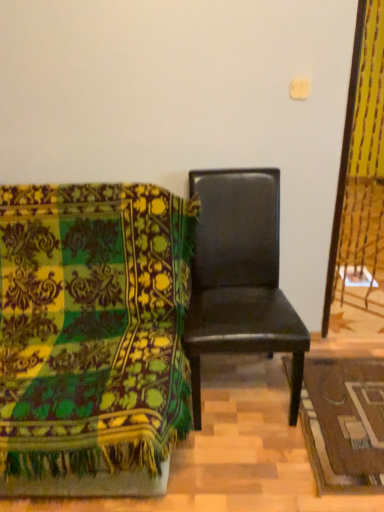
Question: From a real-world perspective, is brown woven mat at lower right physically located above or below black leather chair at center, which is counted as the first chair, starting from the right?

Choices:
 (A) above
 (B) below

Answer: (B)

Question: Is point (354, 464) positioned closer to the camera than point (195, 263)?

Choices:
 (A) farther
 (B) closer

Answer: (B)

Question: Which is nearer to the brown woven mat at lower right?

Choices:
 (A) black leather chair at center, which is counted as the first chair, starting from the right
 (B) velvet green chair at left, arranged as the 2th chair when viewed from the right

Answer: (A)

Question: Estimate the real-world distances between objects in this image. Which object is closer to the brown woven mat at lower right?

Choices:
 (A) velvet green chair at left, arranged as the 2th chair when viewed from the right
 (B) black leather chair at center, which is counted as the first chair, starting from the right

Answer: (B)